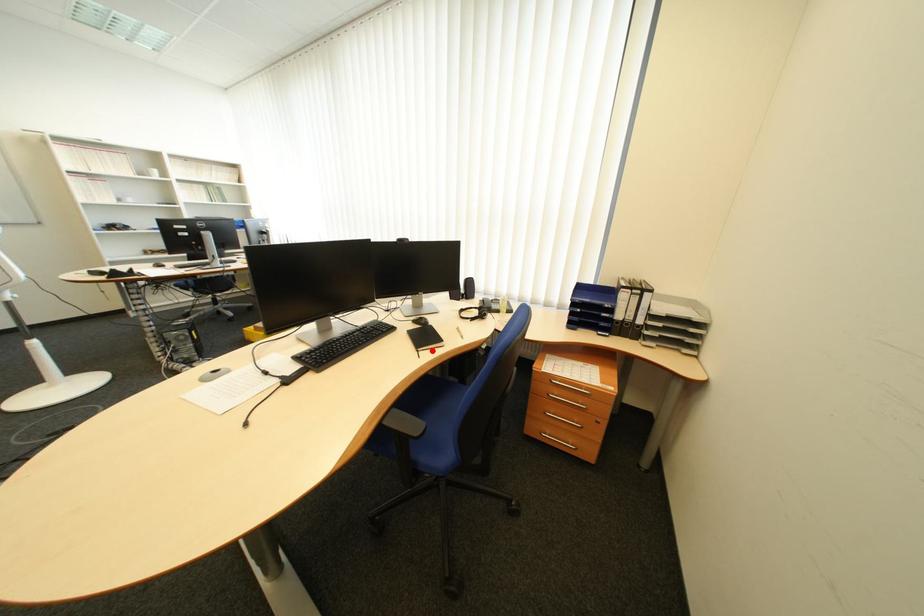
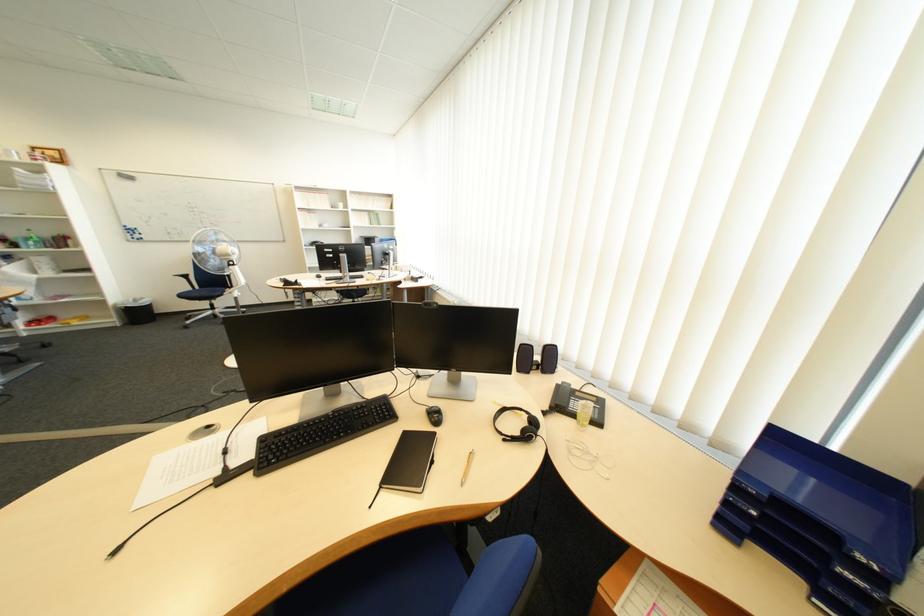
Where in the second image is the point corresponding to the highlighted location from the first image?

(396, 488)